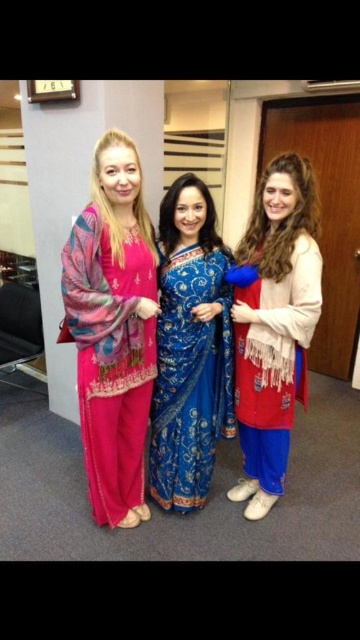
You are organizing a photo shoot and need to arrange the matte red dress at right and the blue silk saree at center based on their sizes. Which one should you place first if you want to start with the larger garment?

The matte red dress at right is larger in size than the blue silk saree at center, so you should place the matte red dress at right first.